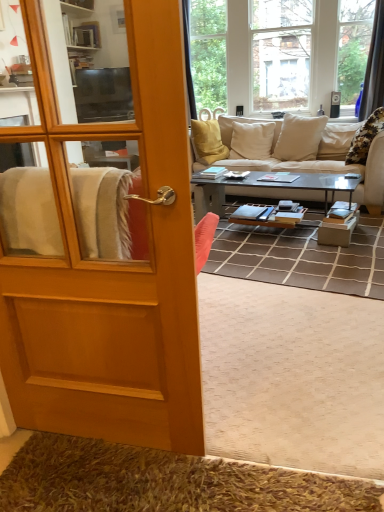
You are a GUI agent. You are given a task and a screenshot of the screen. Output one action in this format:
    pyautogui.click(x=<x>, y=<y>)
    Task: Click on the vacant region below wooden door at left (from a real-world perspective)
    Image resolution: width=384 pixels, height=512 pixels.
    Given the screenshot: What is the action you would take?
    pyautogui.click(x=110, y=436)